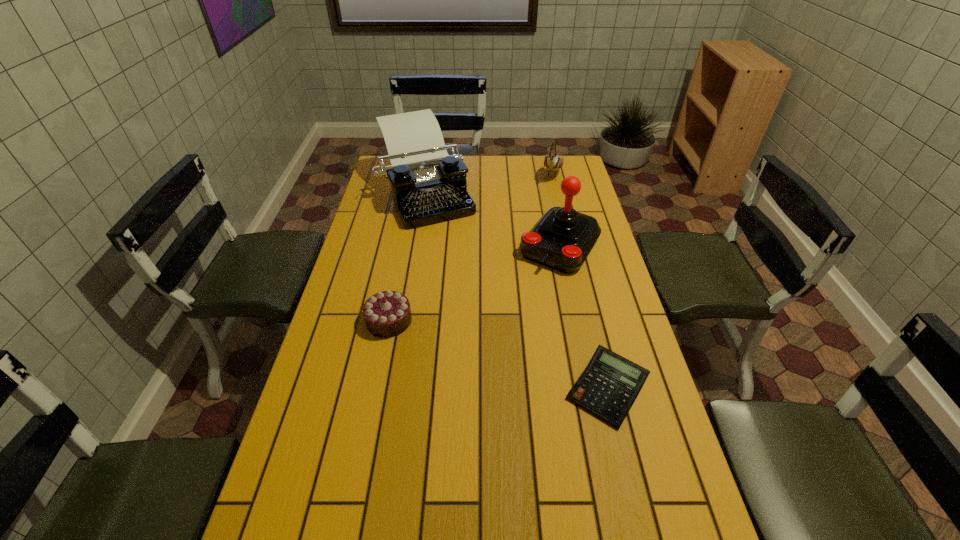
Identify the location of free space at the far left corner of the desktop. (384, 161).

Locate an element on the screen. The width and height of the screenshot is (960, 540). vacant space at the near left corner is located at coordinates (303, 517).

Identify the location of free space at the far right corner of the desktop. (545, 171).

Where is `empty space between the nearest object and the typewriter`? The height and width of the screenshot is (540, 960). empty space between the nearest object and the typewriter is located at coordinates (516, 290).

Find the location of a particular element. The image size is (960, 540). vacant area that lies between the typewriter and the joystick is located at coordinates (493, 218).

Where is `free space between the typewriter and the shortest object`? free space between the typewriter and the shortest object is located at coordinates (516, 290).

The height and width of the screenshot is (540, 960). I want to click on vacant region between the fourth tallest object and the joystick, so click(x=474, y=283).

The height and width of the screenshot is (540, 960). What are the coordinates of `free spot between the second nearest object and the typewriter` in the screenshot? It's located at (408, 256).

I want to click on vacant space in between the third shortest object and the chocolate cake, so click(x=470, y=247).

Find the location of a particular element. vacant space that is in between the shortest object and the chocolate cake is located at coordinates (498, 355).